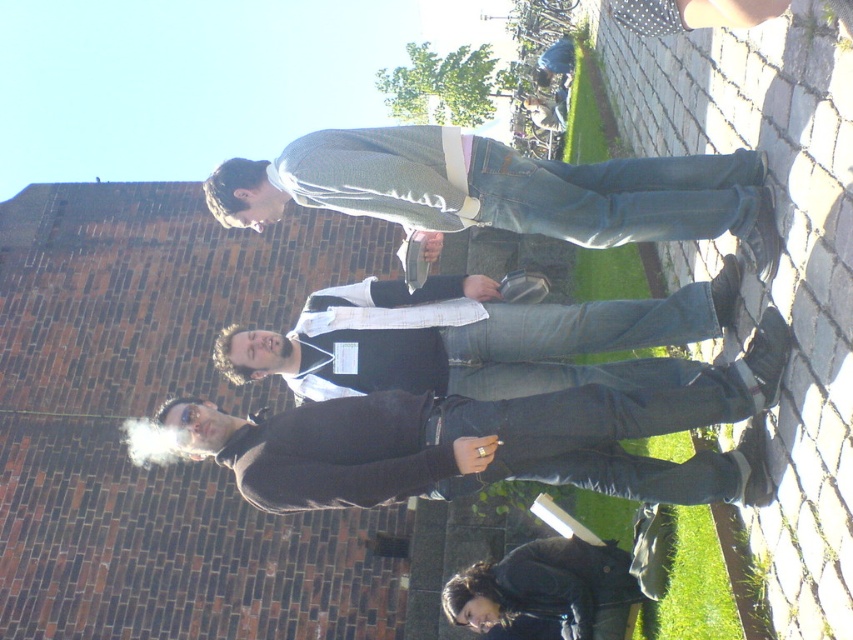
Who is higher up, black cotton shirt at center or dark brown leather jacket at lower center?

Positioned higher is black cotton shirt at center.

Between point (363, 328) and point (506, 576), which one is positioned behind?

The point (506, 576) is behind.

Where is `black cotton shirt at center`? This screenshot has width=853, height=640. black cotton shirt at center is located at coordinates (476, 342).

The width and height of the screenshot is (853, 640). Find the location of `denim jeans at center`. denim jeans at center is located at coordinates (502, 189).

Between denim jeans at center and dark brown leather jacket at lower center, which one appears on the left side from the viewer's perspective?

denim jeans at center is more to the left.

This screenshot has height=640, width=853. What are the coordinates of `denim jeans at center` in the screenshot? It's located at (502, 189).

Which is above, black matte jacket at center or denim jeans at center?

denim jeans at center is higher up.

Who is shorter, black matte jacket at center or denim jeans at center?

denim jeans at center is shorter.

Locate an element on the screen. This screenshot has height=640, width=853. black matte jacket at center is located at coordinates (498, 440).

In order to click on black matte jacket at center in this screenshot , I will do `click(498, 440)`.